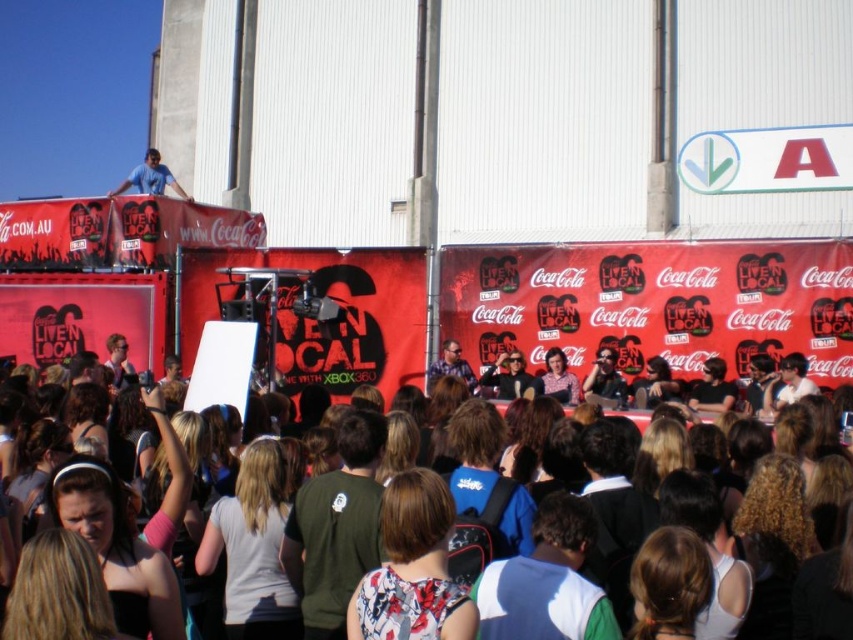
Question: Does brown hair at center have a greater width compared to matte black sunglasses at center?

Choices:
 (A) yes
 (B) no

Answer: (A)

Question: Which object appears closest to the camera in this image?

Choices:
 (A) matte black sunglasses at center
 (B) matte blue shirt at upper left

Answer: (A)

Question: Among these points, which one is farthest from the camera?

Choices:
 (A) pyautogui.click(x=448, y=362)
 (B) pyautogui.click(x=833, y=477)

Answer: (A)

Question: Which object appears closest to the camera in this image?

Choices:
 (A) matte blue shirt at upper left
 (B) brown hair at center
 (C) matte black sunglasses at center

Answer: (B)

Question: In this image, where is brown hair at center located relative to matte blue shirt at upper left?

Choices:
 (A) right
 (B) left

Answer: (A)

Question: Does matte blue shirt at upper left have a greater width compared to matte black sunglasses at center?

Choices:
 (A) yes
 (B) no

Answer: (A)